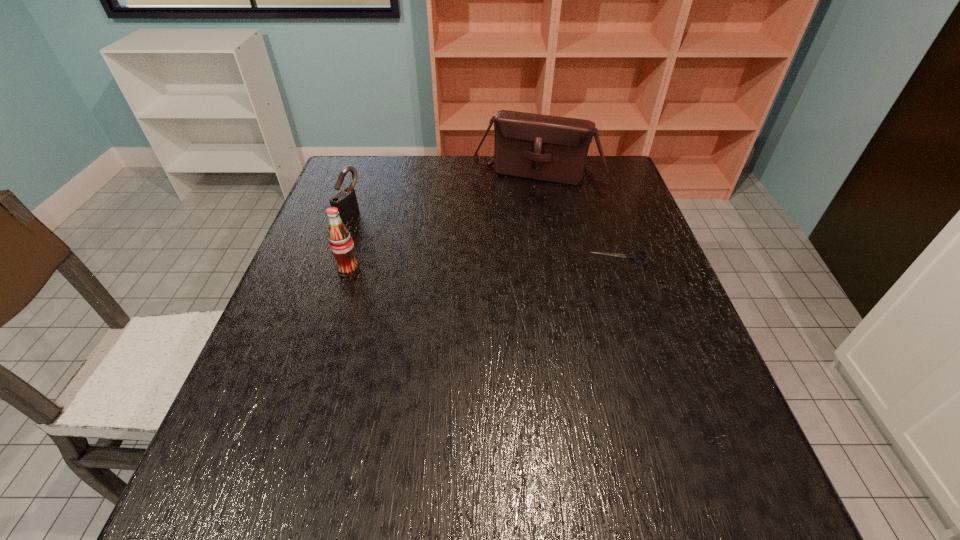
Find the location of `soda`. soda is located at coordinates [341, 244].

The height and width of the screenshot is (540, 960). What are the coordinates of `the shortest object` in the screenshot? It's located at (x=633, y=256).

You are a GUI agent. You are given a task and a screenshot of the screen. Output one action in this format:
    pyautogui.click(x=<x>, y=<y>)
    Task: Click on the second shortest object
    This screenshot has width=960, height=540.
    Given the screenshot: What is the action you would take?
    pyautogui.click(x=345, y=201)

Find the location of a particular element. The image size is (960, 540). the second farthest object is located at coordinates (345, 201).

In order to click on shoulder bag in this screenshot , I will do `click(549, 148)`.

Where is `free space located 0.370m on the front of the soda`? free space located 0.370m on the front of the soda is located at coordinates (301, 422).

The height and width of the screenshot is (540, 960). Identify the location of vacant space situated 0.320m on the back of the shortest object. (594, 184).

Where is `vacant region located 0.050m with the keyhole on the front of the second farthest object`? vacant region located 0.050m with the keyhole on the front of the second farthest object is located at coordinates (372, 224).

At what (x,y) coordinates should I click in order to perform the action: click on free location located with the keyhole on the front of the second farthest object. Please return your answer as a coordinate pair (x, y). The height and width of the screenshot is (540, 960). Looking at the image, I should click on (472, 258).

Where is `vacant space located 0.180m with the keyhole on the front of the second farthest object`? vacant space located 0.180m with the keyhole on the front of the second farthest object is located at coordinates (413, 238).